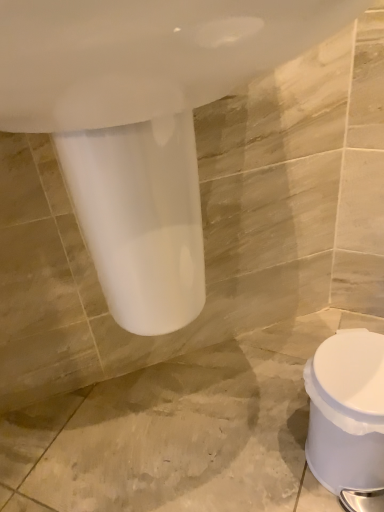
Question: Is white plastic toilet at lower right inside or outside of white glossy sink at upper center?

Choices:
 (A) inside
 (B) outside

Answer: (B)

Question: From a real-world perspective, relative to white glossy sink at upper center, is white plastic toilet at lower right vertically above or below?

Choices:
 (A) above
 (B) below

Answer: (B)

Question: From the image's perspective, is white plastic toilet at lower right located above or below white glossy sink at upper center?

Choices:
 (A) below
 (B) above

Answer: (A)

Question: Looking at the image, does white glossy sink at upper center seem bigger or smaller compared to white plastic toilet at lower right?

Choices:
 (A) small
 (B) big

Answer: (B)

Question: Choose the correct answer: Is white glossy sink at upper center inside white plastic toilet at lower right or outside it?

Choices:
 (A) outside
 (B) inside

Answer: (A)

Question: From the image's perspective, is white glossy sink at upper center positioned above or below white plastic toilet at lower right?

Choices:
 (A) above
 (B) below

Answer: (A)

Question: Is white glossy sink at upper center to the left or to the right of white plastic toilet at lower right in the image?

Choices:
 (A) right
 (B) left

Answer: (B)